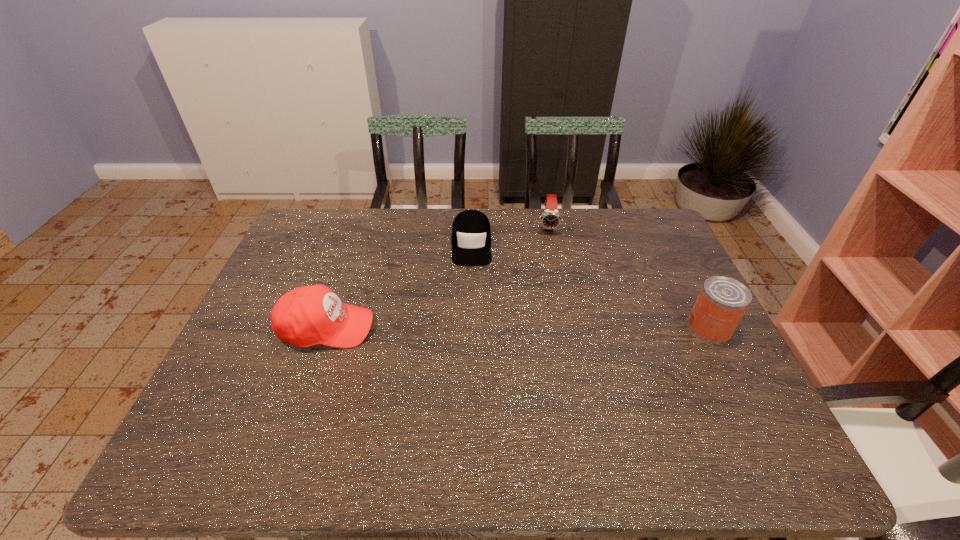
Identify the location of vacant space on the desktop that is between the baseball cap and the can and is positioned on the face of the second object from right to left. (552, 328).

At what (x,y) coordinates should I click in order to perform the action: click on free space on the desktop that is between the baseball cap and the rightmost object and is positioned on the front-facing side of the second object from left to right. Please return your answer as a coordinate pair (x, y). Image resolution: width=960 pixels, height=540 pixels. Looking at the image, I should click on (470, 328).